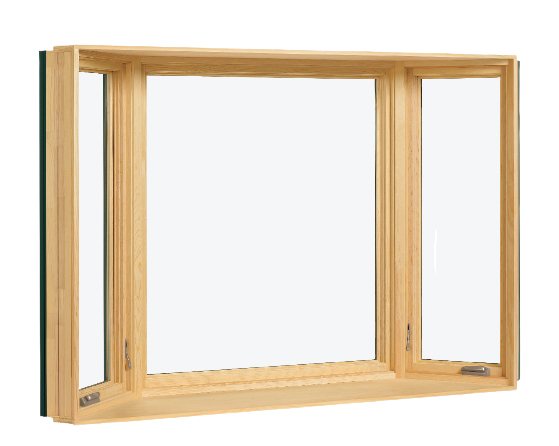
I want to click on detail design on wood, so click(121, 188).